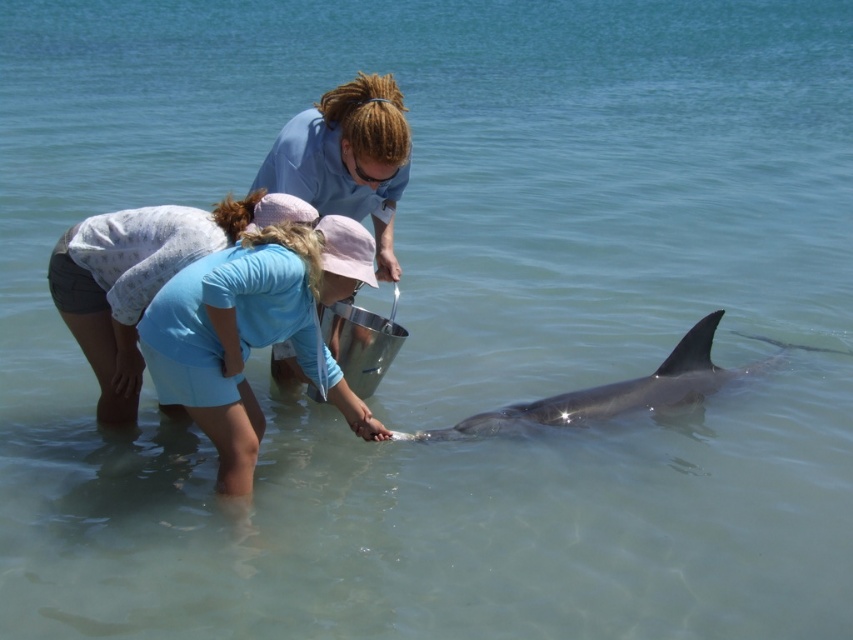
Question: Which point is closer to the camera?

Choices:
 (A) blue cotton shirt at center
 (B) gray smooth dolphin at lower center

Answer: (A)

Question: Is blue cotton shirt at center above gray smooth dolphin at lower center?

Choices:
 (A) yes
 (B) no

Answer: (A)

Question: Is blue cotton shirt at center to the left of gray smooth dolphin at lower center from the viewer's perspective?

Choices:
 (A) no
 (B) yes

Answer: (B)

Question: From the image, what is the correct spatial relationship of blue cotton shirt at center in relation to gray smooth dolphin at lower center?

Choices:
 (A) right
 (B) left

Answer: (B)

Question: Which point is closer to the camera?

Choices:
 (A) (335, 289)
 (B) (601, 410)

Answer: (A)